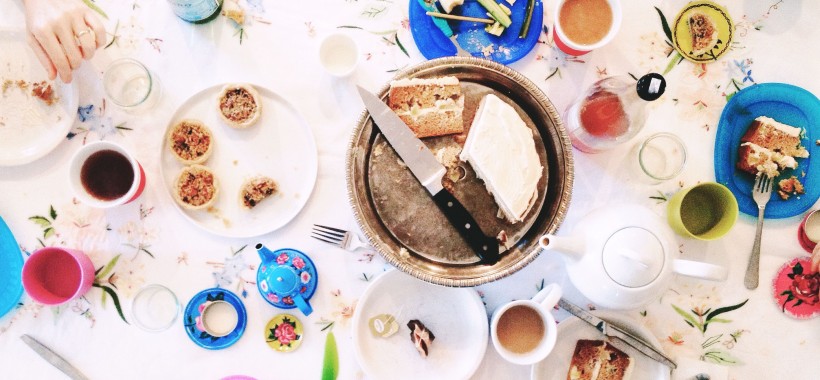
Find the location of a particular element. The image size is (820, 380). cup is located at coordinates tap(135, 100).